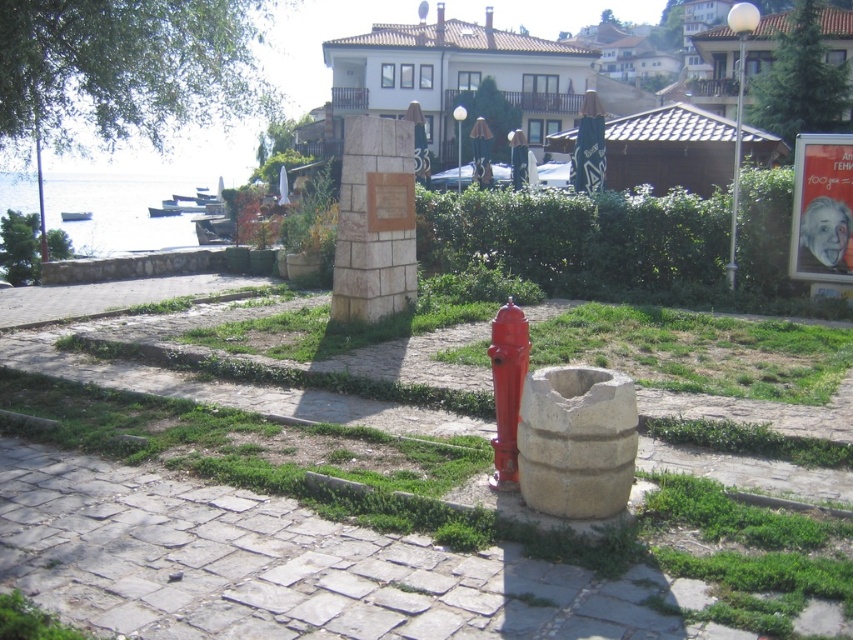
From the picture: You are a maintenance worker needing to reach both the stone plaque at center and the red matte hydrant at center. Which object is taller and requires a ladder to reach?

The stone plaque at center is much taller than the red matte hydrant at center, so the stone plaque at center would require a ladder to reach.

You are standing at the waterfront and see the green grass at center and the blue water at left. Which object is located to the right of the other?

The green grass at center is located to the right of the blue water at left.